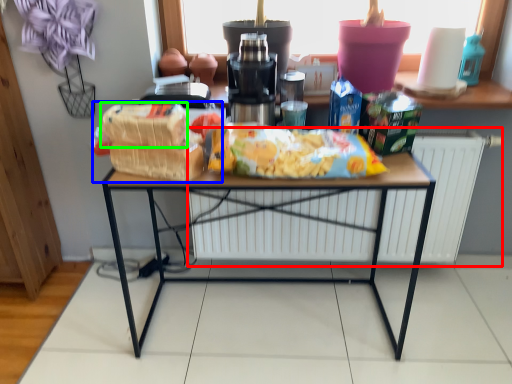
Question: Which is nearer to the radiator (highlighted by a red box)? snack (highlighted by a blue box) or cereal (highlighted by a green box).

Choices:
 (A) snack
 (B) cereal

Answer: (A)